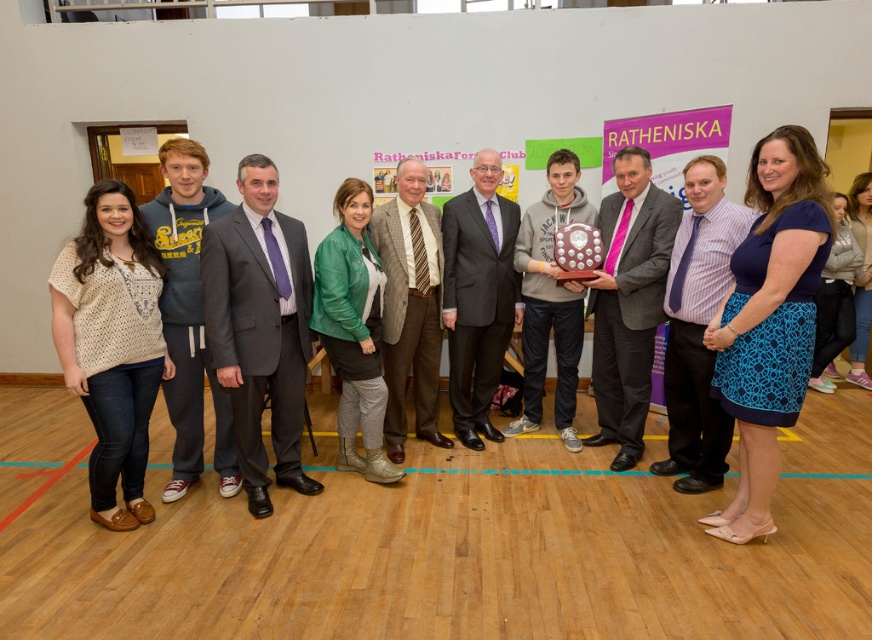
You are standing in front of the group photo and want to determine the relative positions of two points marked on the image. Which of the two points, point (641, 225) or point (468, 260), is closer to you?

Point (641, 225) is closer to the viewer than point (468, 260).

You are a photographer adjusting the camera focus. The dark gray suit at center and the brown textured blazer at center are two key elements in the photo. Since they are both at the center, can you tell me which one is closer to the camera?

The dark gray suit at center and brown textured blazer at center are 25.09 centimeters apart, but without knowing which is in front of the other, I cannot determine which is closer to the camera.